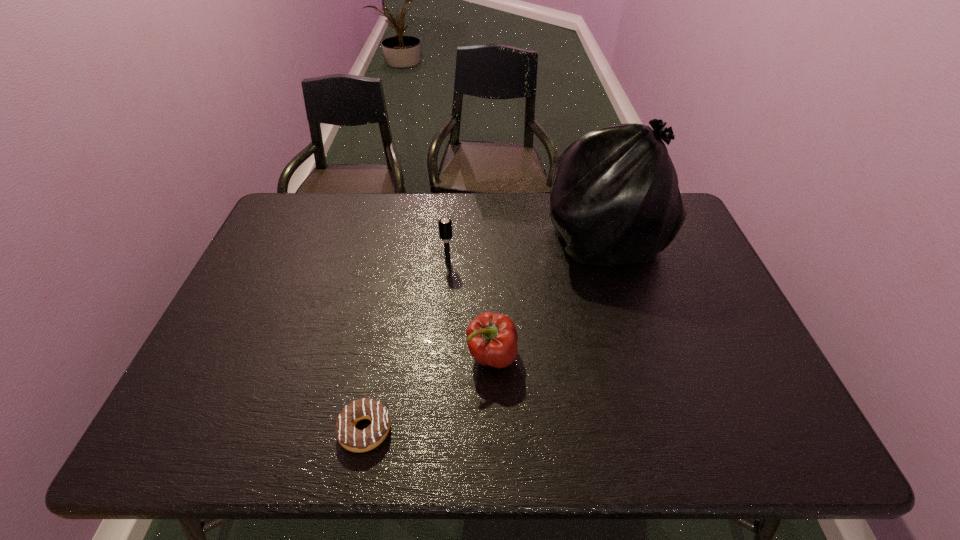
Identify the location of plastic bag. (615, 199).

Find the location of a particular element. the rightmost object is located at coordinates (615, 199).

Locate an element on the screen. This screenshot has height=540, width=960. the second object from left to right is located at coordinates pyautogui.click(x=445, y=228).

Find the location of a particular element. hairbrush is located at coordinates (445, 228).

Locate an element on the screen. This screenshot has height=540, width=960. the second shortest object is located at coordinates (492, 338).

This screenshot has width=960, height=540. Identify the location of the second object from right to left. (492, 338).

Where is `the leftmost object`? the leftmost object is located at coordinates (355, 440).

You are a GUI agent. You are given a task and a screenshot of the screen. Output one action in this format:
    pyautogui.click(x=<x>, y=<y>)
    Task: Click on the doughnut
    
    Given the screenshot: What is the action you would take?
    pyautogui.click(x=355, y=440)

Identify the location of vacant space located 0.200m on the left of the plastic bag. (478, 238).

Locate an element on the screen. free space located 0.200m on the right of the second object from left to right is located at coordinates (520, 262).